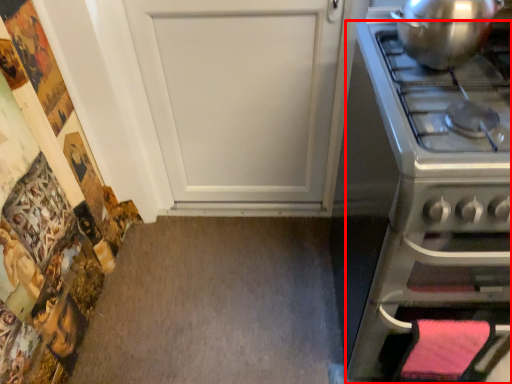
Question: Observing the image, what is the correct spatial positioning of oven (annotated by the red box) in reference to kitchen appliance?

Choices:
 (A) right
 (B) left

Answer: (A)